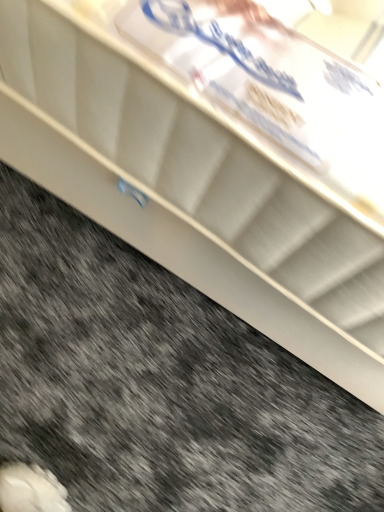
What do you see at coordinates (159, 383) in the screenshot? I see `white glossy mattress at upper center` at bounding box center [159, 383].

This screenshot has width=384, height=512. I want to click on white glossy mattress at upper center, so click(159, 383).

What is the approximate height of white glossy mattress at upper center?

white glossy mattress at upper center is 2.40 inches tall.

This screenshot has height=512, width=384. Identify the location of white glossy mattress at upper center. (159, 383).